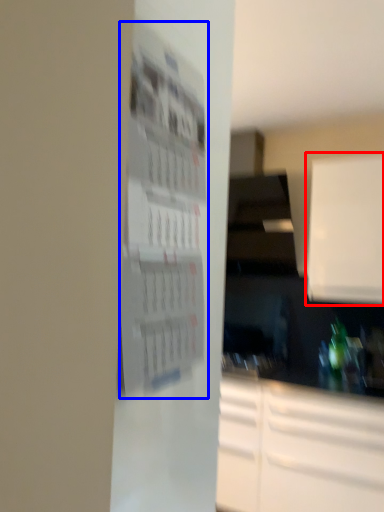
Question: Among these objects, which one is farthest to the camera, cabinetry (highlighted by a red box) or bulletin board (highlighted by a blue box)?

Choices:
 (A) cabinetry
 (B) bulletin board

Answer: (A)